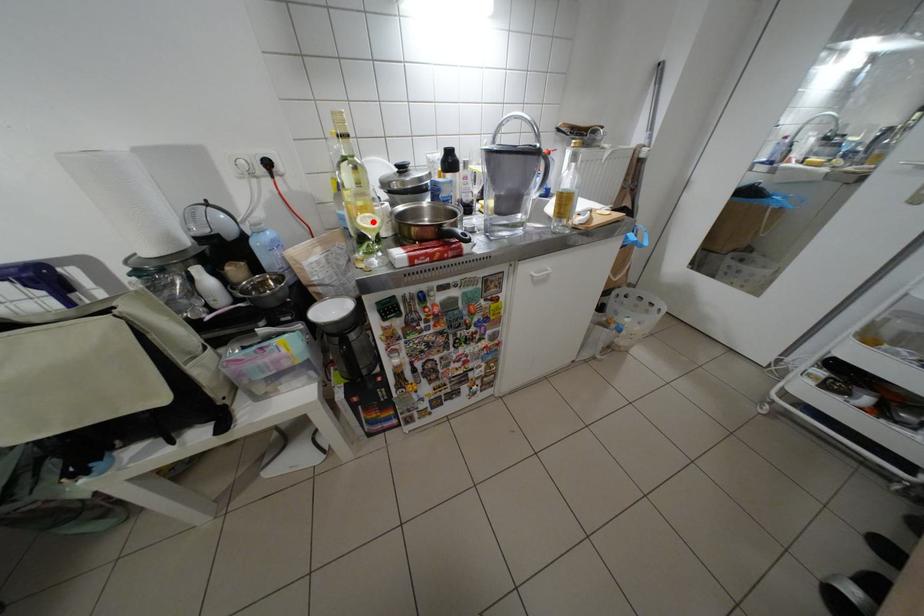
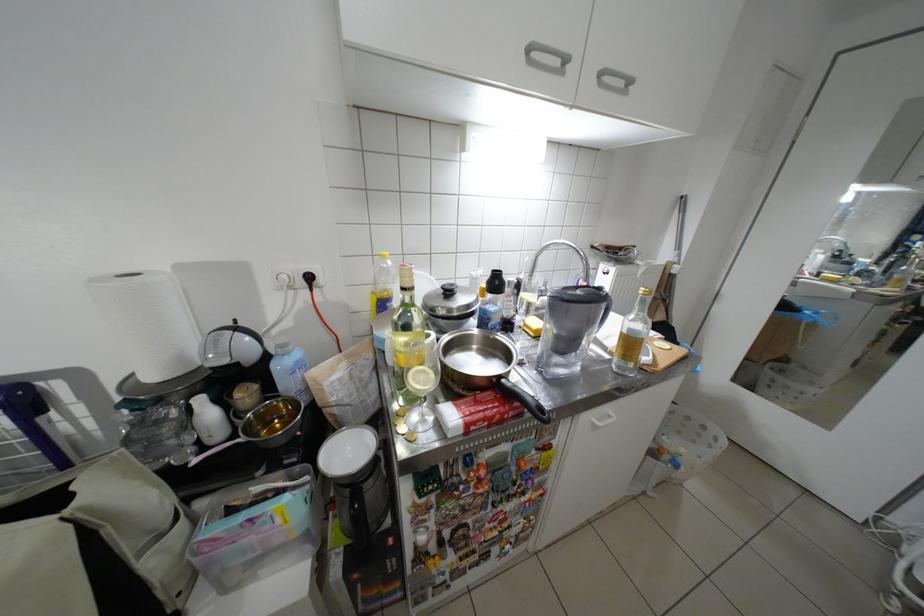
Locate, in the second image, the point that corresponds to the highlighted location in the first image.

(426, 379)